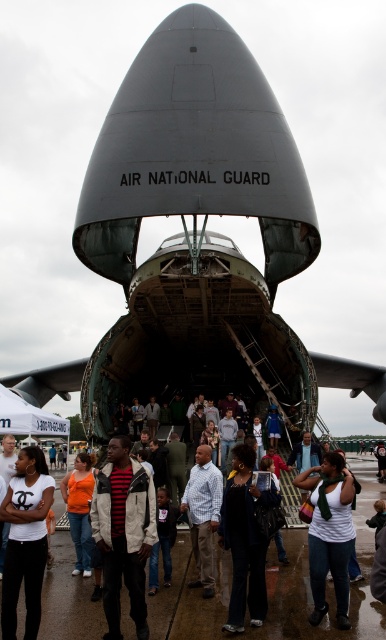
Is point (154, 600) behind point (252, 550)?

Yes, it is.

Is shiny asphalt tarmac at center to the left of dark blue jeans at center from the viewer's perspective?

Yes, shiny asphalt tarmac at center is to the left of dark blue jeans at center.

Describe the element at coordinates (326, 582) in the screenshot. I see `shiny asphalt tarmac at center` at that location.

Locate an element on the screen. The width and height of the screenshot is (386, 640). shiny asphalt tarmac at center is located at coordinates pyautogui.click(x=326, y=582).

Between white cotton t-shirt at center and white matte shirt at center, which one has more height?

white cotton t-shirt at center is taller.

Does point (10, 509) lie in front of point (335, 580)?

No, (10, 509) is further to viewer.

What are the coordinates of `white cotton t-shirt at center` in the screenshot? It's located at (25, 540).

Can you confirm if metallic gray aircraft at center is taller than blue plaid shirt at center?

Yes, metallic gray aircraft at center is taller than blue plaid shirt at center.

Who is higher up, metallic gray aircraft at center or blue plaid shirt at center?

metallic gray aircraft at center

Which is behind, point (30, 237) or point (203, 584)?

The point (30, 237) is more distant.

At what (x,y) coordinates should I click in order to perform the action: click on metallic gray aircraft at center. Please return your answer as a coordinate pair (x, y). This screenshot has width=386, height=640. Looking at the image, I should click on (57, 164).